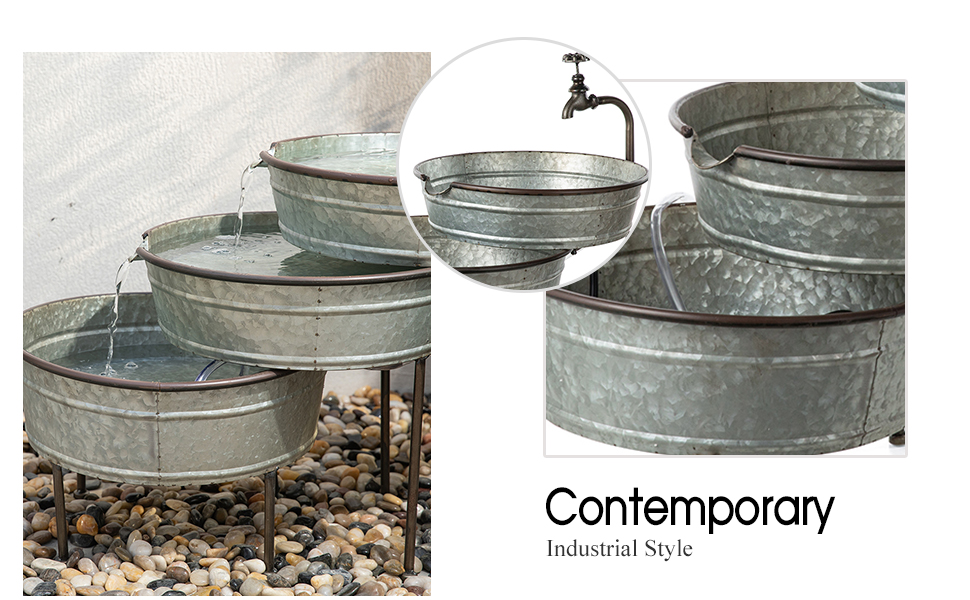
At what (x,y) coordinates should I click in order to perform the action: click on metal legs. Please return your answer as a coordinate pair (x, y). The image size is (970, 600). Looking at the image, I should click on (415, 409), (384, 413), (271, 494), (55, 491).